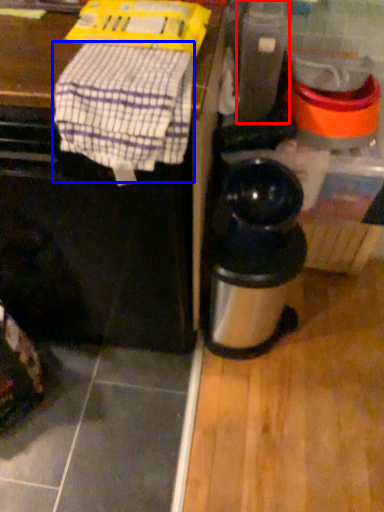
Question: Which of the following is the farthest to the observer, appliance (highlighted by a red box) or blanket (highlighted by a blue box)?

Choices:
 (A) appliance
 (B) blanket

Answer: (A)